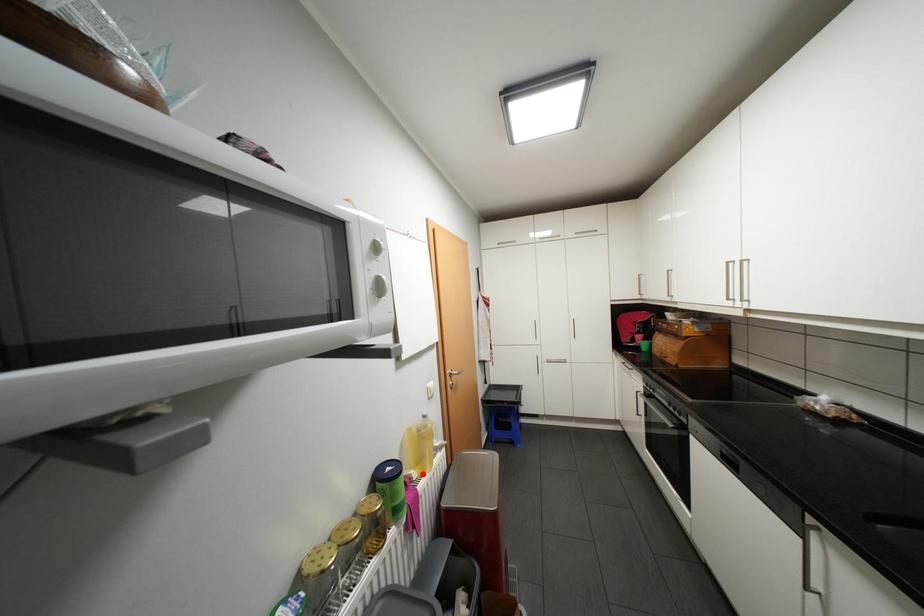
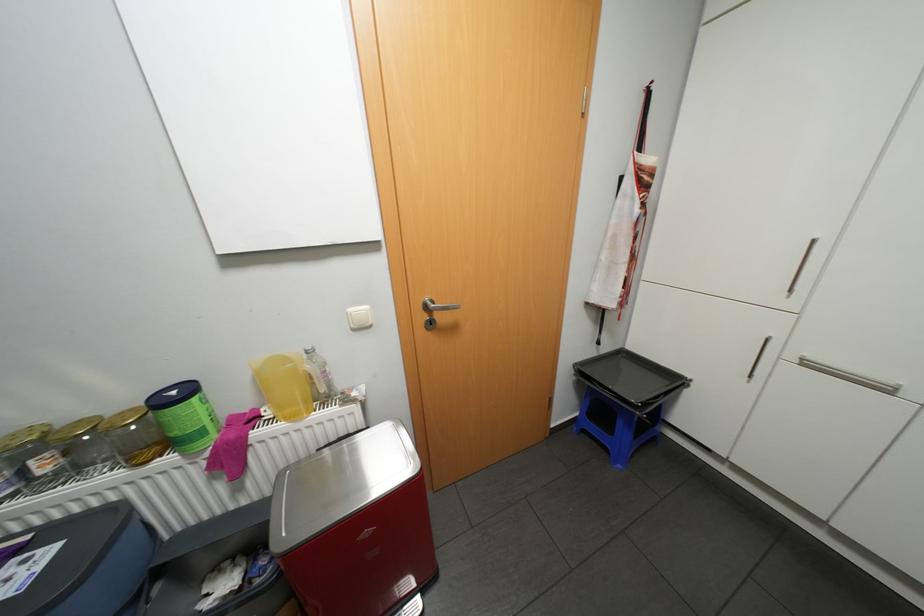
Locate, in the second image, the point that corresponds to the highlighted location in the first image.

(275, 413)